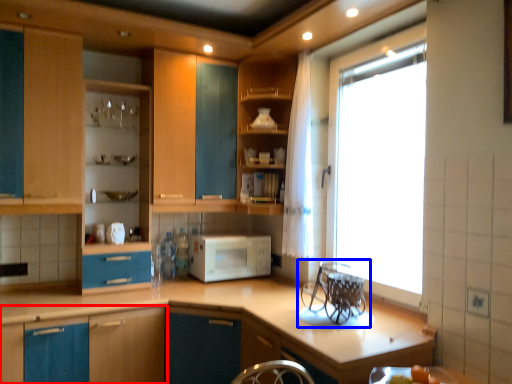
Question: Which point is further to the camera, cabinetry (highlighted by a red box) or appliance (highlighted by a blue box)?

Choices:
 (A) cabinetry
 (B) appliance

Answer: (A)